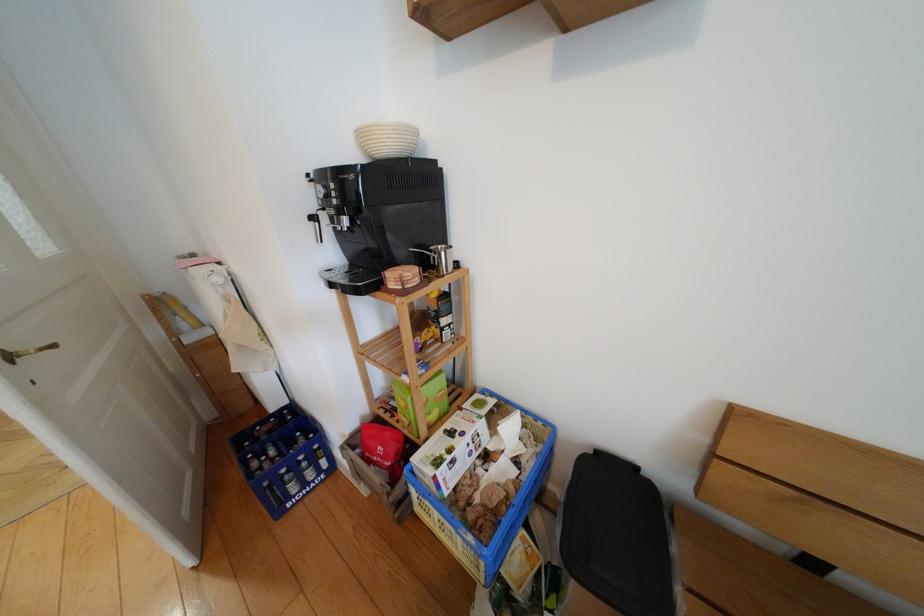
Find where to lift the white cardboard box. Please return your answer as a coordinate pair (x, y).

(450, 451)